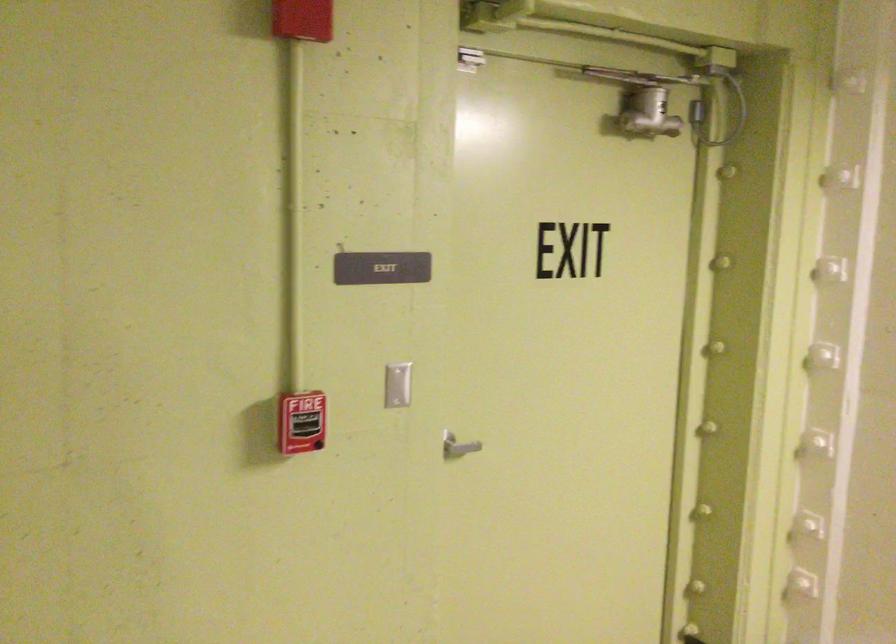
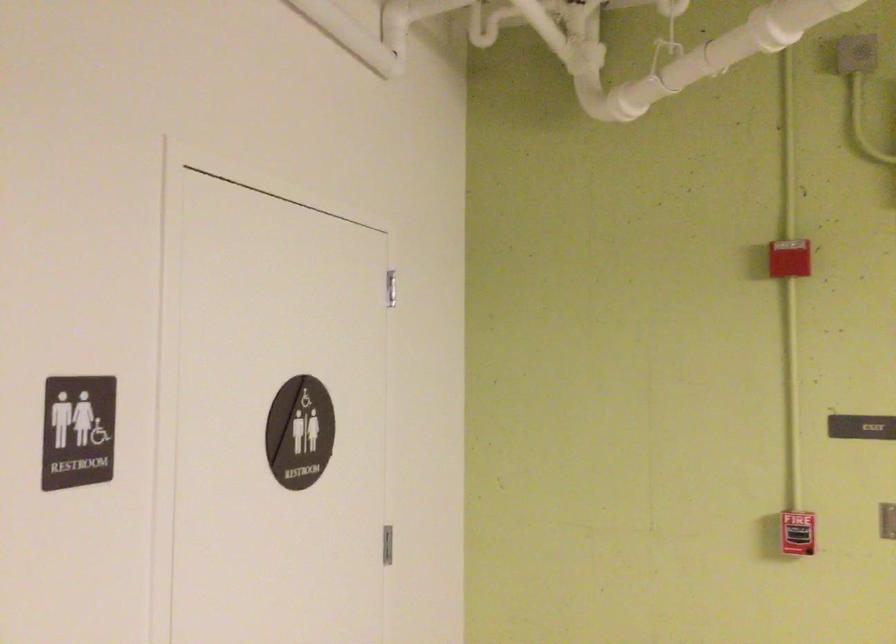
Where in the second image is the point corresponding to (291,402) from the first image?

(797, 533)